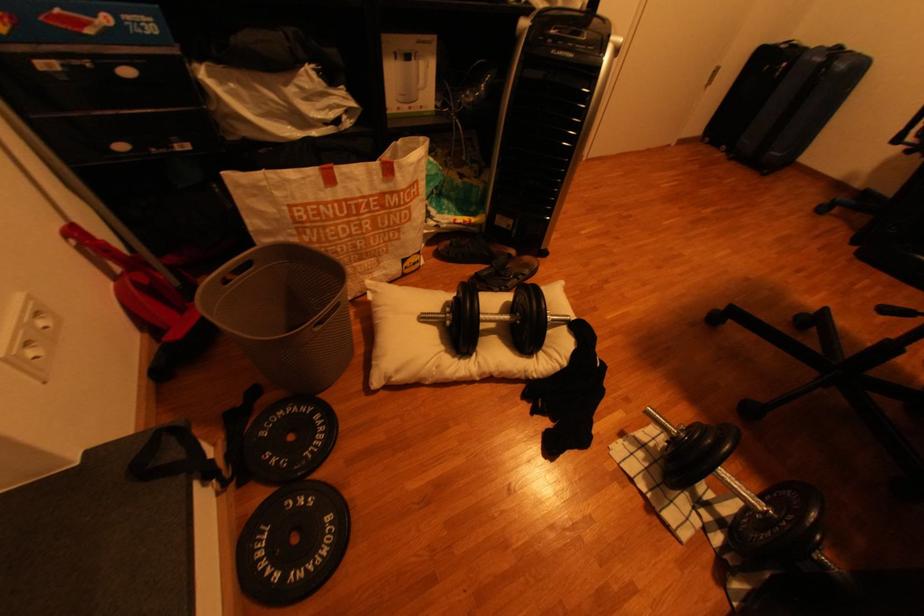
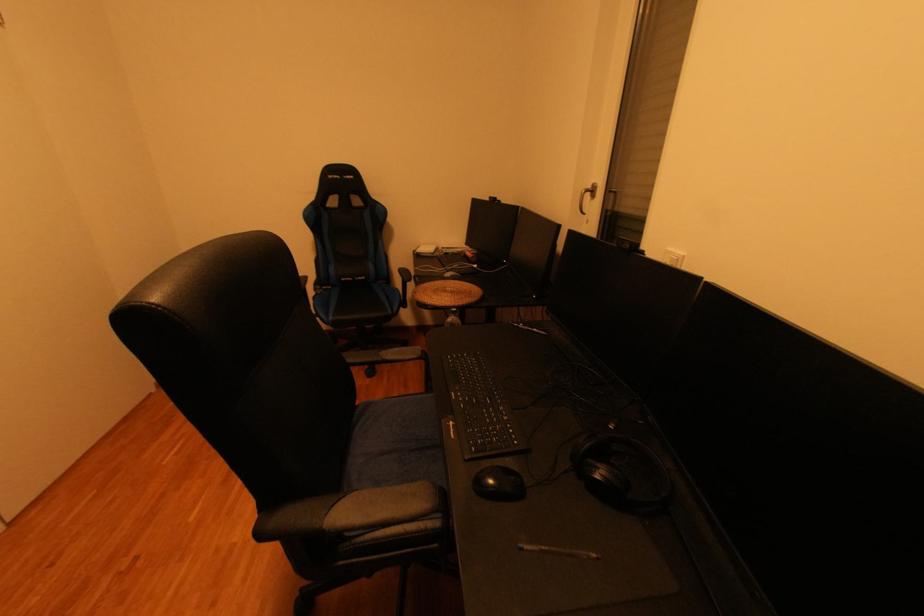
Question: The first image is from the beginning of the video and the second image is from the end. How did the camera likely rotate when shooting the video?

Choices:
 (A) Left
 (B) Right
 (C) Up
 (D) Down

Answer: (B)